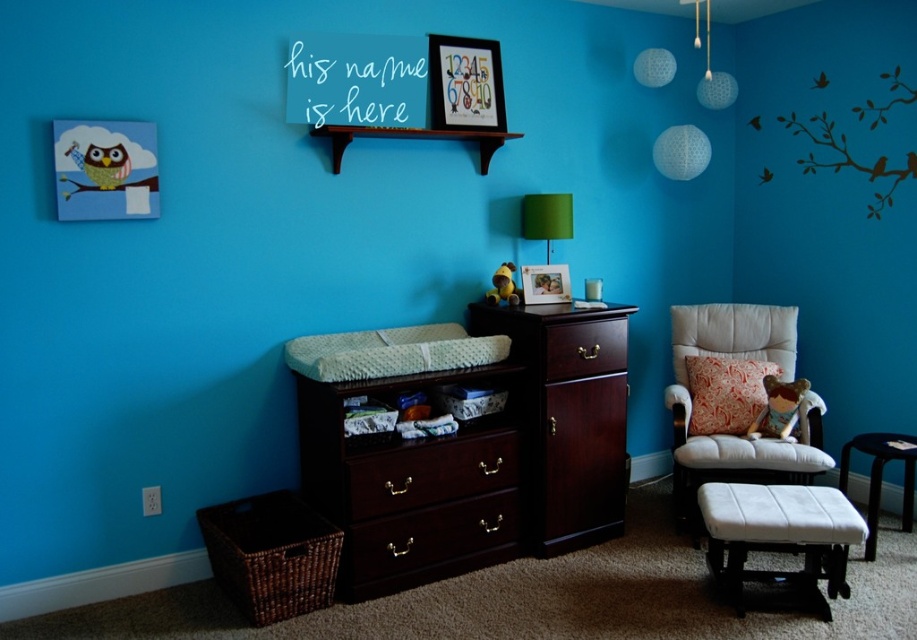
You are a parent trying to organize the nursery. You need to place a tall decorative vase that requires a stable, elevated surface. Which object between the mahogany wood dresser at center and the floral fabric pillow at right would be more suitable for placing the vase?

The mahogany wood dresser at center is taller than the floral fabric pillow at right, making it more stable and suitable for placing the tall decorative vase.

You are a parent trying to organize the nursery. You have a large baby toy that needs to be placed on either the mahogany wood dresser at center or the floral fabric pillow at right. Based on their sizes, which surface can accommodate the toy more comfortably?

The mahogany wood dresser at center is bigger than the floral fabric pillow at right, so the large baby toy can be placed more comfortably on the mahogany wood dresser at center.